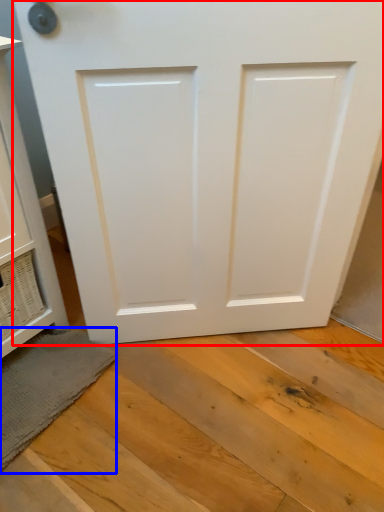
Question: Which object is closer to the camera taking this photo, door (highlighted by a red box) or bath mat (highlighted by a blue box)?

Choices:
 (A) door
 (B) bath mat

Answer: (A)